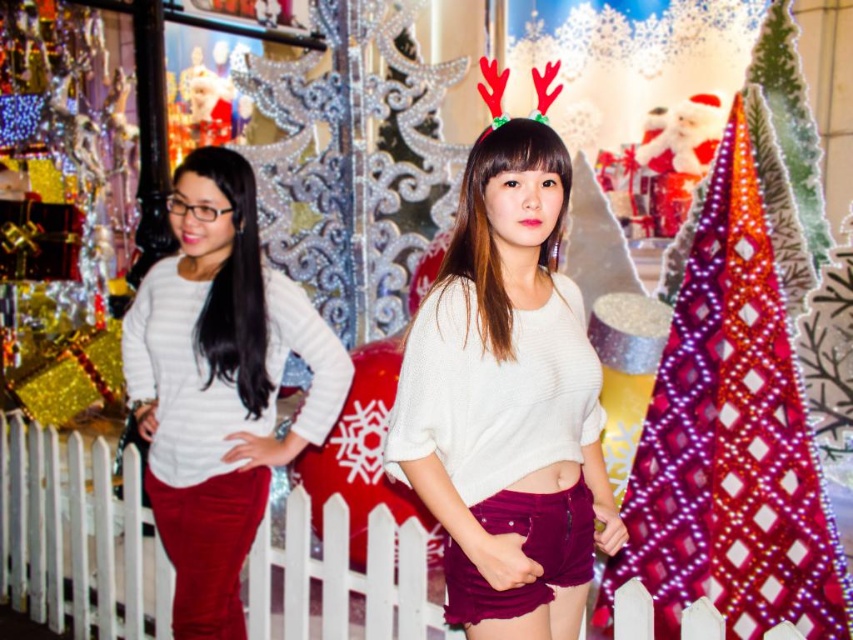
You are a photographer trying to frame a shot that includes both the velvet burgundy shorts at center and the shiny metallic christmas tree at right. Which object should you focus on first to ensure both fit in the frame?

Since the shiny metallic christmas tree at right takes up more space than the velvet burgundy shorts at center, you should focus on positioning the tree first to ensure it fits, then adjust the frame to include the shorts.

You are organizing a photo shoot and need to ensure that the velvet burgundy shorts at center and the white matte sweater at center fit within a 1.2 meter wide frame. Based on their widths, will both items fit side by side without overlapping?

The velvet burgundy shorts at center is narrower than the white matte sweater at center. However, since the total width of both items combined may exceed 1.2 meters, it depends on their exact dimensions. The description only states the shorts are narrower, but not by how much.

You are a photographer setting up for a Christmas photo shoot. You have two subjects wearing velvet burgundy shorts at center and shiny metallic christmas tree at right. Which subject should you focus on first if you want to capture the tallest object in the frame?

The shiny metallic christmas tree at right is taller than the velvet burgundy shorts at center, so you should focus on the shiny metallic christmas tree at right first to capture the tallest object in the frame.